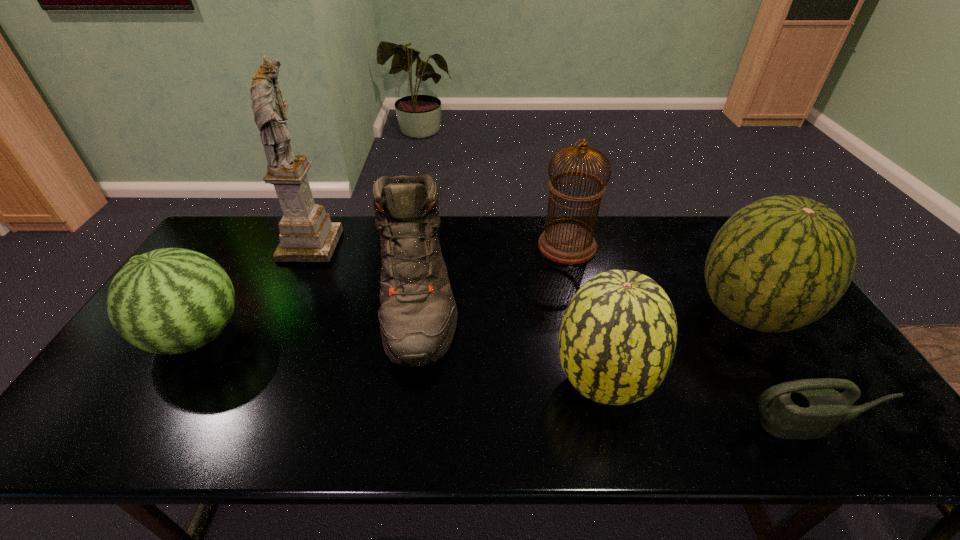
Image resolution: width=960 pixels, height=540 pixels. Identify the location of free space between the fifth object from right to left and the leftmost watermelon. (307, 315).

Where is `free space between the rightmost watermelon and the watering can`? free space between the rightmost watermelon and the watering can is located at coordinates pos(777,369).

Find the location of a particular element. The width and height of the screenshot is (960, 540). vacant space that's between the fifth object from right to left and the sculpture is located at coordinates (364, 270).

Image resolution: width=960 pixels, height=540 pixels. In order to click on free point between the shortest object and the rightmost watermelon in this screenshot , I will do `click(777, 369)`.

This screenshot has width=960, height=540. Identify the location of empty space that is in between the rightmost watermelon and the birdcage. (658, 280).

Locate an element on the screen. This screenshot has height=540, width=960. object that ranks as the sixth closest to the sculpture is located at coordinates (809, 408).

Find the location of a particular element. The width and height of the screenshot is (960, 540). object that is the second closest one to the birdcage is located at coordinates (418, 315).

Find the location of `the closest watermelon to the fifth object from right to left`. the closest watermelon to the fifth object from right to left is located at coordinates (617, 340).

This screenshot has width=960, height=540. In order to click on watermelon that is the closest one to the tallest object in this screenshot , I will do `click(172, 300)`.

I want to click on vacant area in the image that satisfies the following two spatial constraints: 1. on the front-facing side of the rightmost watermelon; 2. on the left side of the sculpture, so point(278,313).